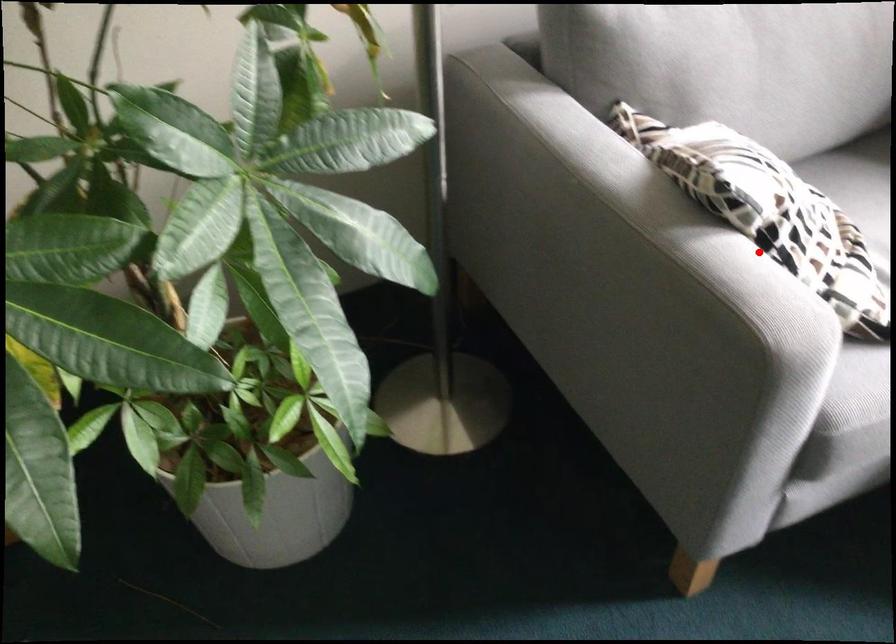
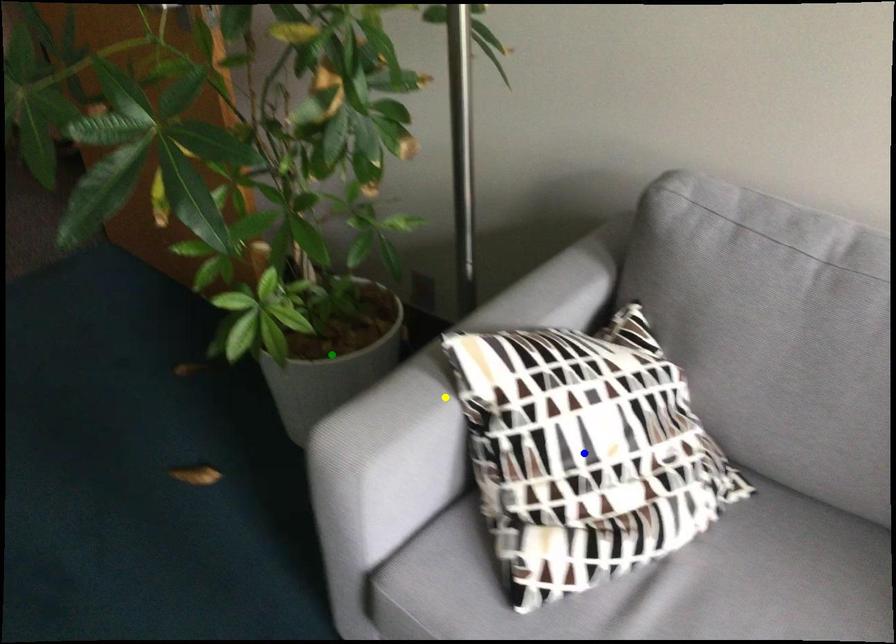
Question: I am providing you with two images of the same scene from different viewpoints. A red point is marked on the first image. You are given multiple points on the second image. In image 2, which mark is for the same physical point as the one in image 1?

Choices:
 (A) blue point
 (B) green point
 (C) yellow point

Answer: (C)